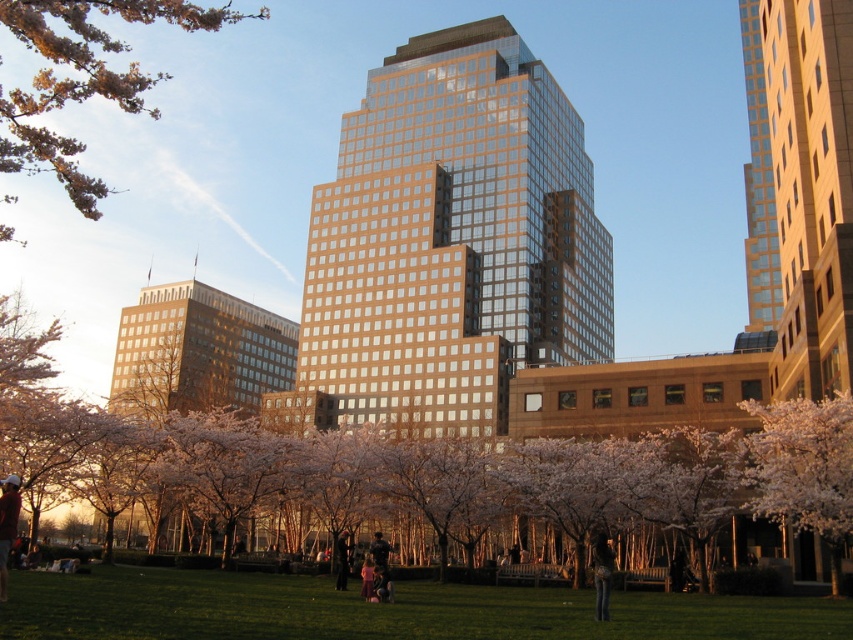
This screenshot has height=640, width=853. Describe the element at coordinates (451, 241) in the screenshot. I see `gold reflective glass building at center` at that location.

Which of these two, gold reflective glass building at center or green grass at lower center, stands shorter?

With less height is green grass at lower center.

Is point (329, 412) closer to viewer compared to point (177, 598)?

No.

What are the coordinates of `gold reflective glass building at center` in the screenshot? It's located at (451, 241).

In the scene shown: Between gold reflective glass building at center and jeans at lower center, which one has more height?

gold reflective glass building at center is taller.

Between gold reflective glass building at center and jeans at lower center, which one is positioned lower?

jeans at lower center is below.

The width and height of the screenshot is (853, 640). What do you see at coordinates (451, 241) in the screenshot? I see `gold reflective glass building at center` at bounding box center [451, 241].

Locate an element on the screen. gold reflective glass building at center is located at coordinates (451, 241).

Does pink blossoms at upper left have a greater height compared to dark brown leather jacket at lower left?

Indeed, pink blossoms at upper left has a greater height compared to dark brown leather jacket at lower left.

Which is in front, point (48, 84) or point (4, 547)?

Positioned in front is point (4, 547).

Locate an element on the screen. This screenshot has height=640, width=853. pink blossoms at upper left is located at coordinates (80, 77).

Where is `pink blossoms at upper left`? The height and width of the screenshot is (640, 853). pink blossoms at upper left is located at coordinates (80, 77).